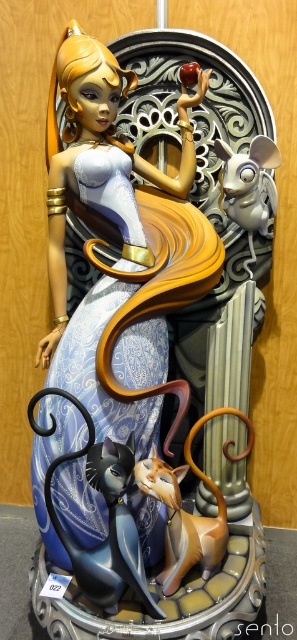
Question: Can you confirm if matte blue fabric doll at center is wider than satin silver mouse at upper right?

Choices:
 (A) no
 (B) yes

Answer: (B)

Question: Can you confirm if matte black cat at lower center is positioned to the left of shiny gold cat at center?

Choices:
 (A) no
 (B) yes

Answer: (B)

Question: Is matte blue fabric doll at center positioned before satin silver mouse at upper right?

Choices:
 (A) yes
 (B) no

Answer: (A)

Question: Which of the following is the farthest from the observer?

Choices:
 (A) matte black cat at lower center
 (B) matte blue fabric doll at center

Answer: (B)

Question: Which of the following is the closest to the observer?

Choices:
 (A) (108, 413)
 (B) (250, 259)
 (C) (169, 467)

Answer: (A)

Question: Considering the real-world distances, which object is closest to the satin silver mouse at upper right?

Choices:
 (A) matte black cat at lower center
 (B) shiny gold cat at center
 (C) matte blue fabric doll at center

Answer: (C)